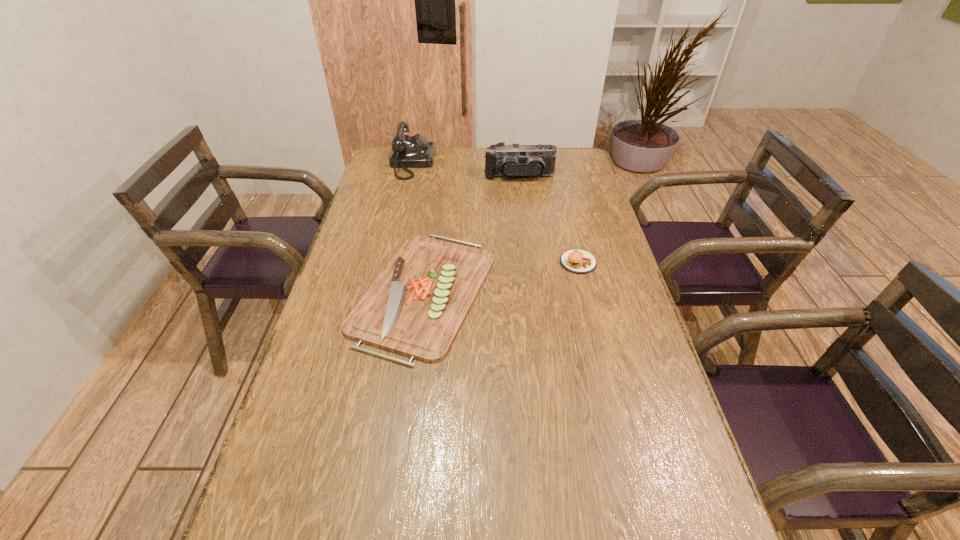
This screenshot has height=540, width=960. I want to click on free spot that satisfies the following two spatial constraints: 1. on the dial of the patty; 2. on the right side of the telephone, so click(390, 262).

Where is `blank space that satisfies the following two spatial constraints: 1. on the front-facing side of the camcorder; 2. on the left side of the patty`? Image resolution: width=960 pixels, height=540 pixels. blank space that satisfies the following two spatial constraints: 1. on the front-facing side of the camcorder; 2. on the left side of the patty is located at coordinates (530, 262).

This screenshot has width=960, height=540. Find the location of `free point that satisfies the following two spatial constraints: 1. on the back side of the patty; 2. on the dial of the telephone`. free point that satisfies the following two spatial constraints: 1. on the back side of the patty; 2. on the dial of the telephone is located at coordinates (554, 163).